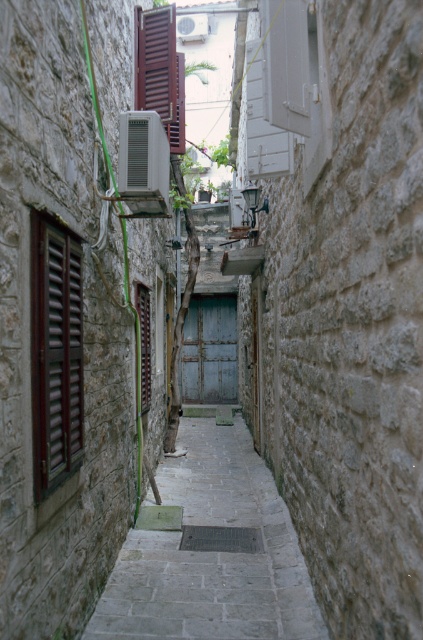
Is point (280, 604) positioned behind point (143, 378)?

No, (280, 604) is in front of (143, 378).

Who is more forward, (264,506) or (140,332)?

Point (140,332) is in front.

Identify the location of stone paved path at center. This screenshot has width=423, height=640. (211, 554).

Is brown wooden shutter at upper left taller than wooden brown shutter at center?

Yes, brown wooden shutter at upper left is taller than wooden brown shutter at center.

The width and height of the screenshot is (423, 640). What do you see at coordinates (161, 72) in the screenshot?
I see `brown wooden shutter at upper left` at bounding box center [161, 72].

What do you see at coordinates (161, 72) in the screenshot? Image resolution: width=423 pixels, height=640 pixels. I see `brown wooden shutter at upper left` at bounding box center [161, 72].

The height and width of the screenshot is (640, 423). Identify the location of brown wooden shutter at upper left. (161, 72).

Between point (54, 336) and point (145, 404), which one is positioned behind?

Point (145, 404)

Does brown wooden shutters at left have a greater width compared to wooden brown shutter at center?

In fact, brown wooden shutters at left might be narrower than wooden brown shutter at center.

This screenshot has height=640, width=423. I want to click on brown wooden shutters at left, so click(x=55, y=353).